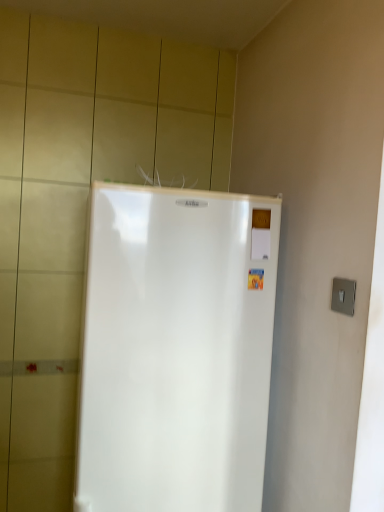
What do you see at coordinates (343, 296) in the screenshot? This screenshot has height=512, width=384. I see `satin silver switch at right` at bounding box center [343, 296].

Measure the distance between satin silver switch at right and camera.

satin silver switch at right is 1.01 meters from camera.

Find the location of a particular element. The height and width of the screenshot is (512, 384). satin silver switch at right is located at coordinates (343, 296).

Where is `white glossy refrigerator at center`? The image size is (384, 512). white glossy refrigerator at center is located at coordinates (175, 350).

What do you see at coordinates (175, 350) in the screenshot?
I see `white glossy refrigerator at center` at bounding box center [175, 350].

You are a GUI agent. You are given a task and a screenshot of the screen. Output one action in this format:
    pyautogui.click(x=<x>, y=<y>)
    Task: Click on the satin silver switch at right
    
    Given the screenshot: What is the action you would take?
    pyautogui.click(x=343, y=296)

Is satin silver switch at right at the right side of white glossy refrigerator at center?

Correct, you'll find satin silver switch at right to the right of white glossy refrigerator at center.

Is satin silver switch at right closer to the viewer compared to white glossy refrigerator at center?

Yes, it is in front of white glossy refrigerator at center.

Does point (342, 283) lie behind point (144, 378)?

No, (342, 283) is closer to viewer.

From the image's perspective, is satin silver switch at right located above or below white glossy refrigerator at center?

satin silver switch at right is above white glossy refrigerator at center.

From a real-world perspective, is satin silver switch at right above or below white glossy refrigerator at center?

In terms of real-world spatial position, satin silver switch at right is above white glossy refrigerator at center.

Can you confirm if satin silver switch at right is wider than white glossy refrigerator at center?

No.

Which of these two, satin silver switch at right or white glossy refrigerator at center, stands shorter?

satin silver switch at right is shorter.

In terms of size, does satin silver switch at right appear bigger or smaller than white glossy refrigerator at center?

In the image, satin silver switch at right appears to be smaller than white glossy refrigerator at center.

Is satin silver switch at right inside the boundaries of white glossy refrigerator at center, or outside?

satin silver switch at right is outside white glossy refrigerator at center.

Is satin silver switch at right directly adjacent to white glossy refrigerator at center?

Result: No.

Is satin silver switch at right facing towards white glossy refrigerator at center?

No, satin silver switch at right does not turn towards white glossy refrigerator at center.

How different are the orientations of satin silver switch at right and white glossy refrigerator at center in degrees?

80.8 degrees.

This screenshot has height=512, width=384. I want to click on electric outlet that appears in front of the white glossy refrigerator at center, so click(x=343, y=296).

Would you say white glossy refrigerator at center is to the left or to the right of satin silver switch at right in the picture?

Based on their positions, white glossy refrigerator at center is located to the left of satin silver switch at right.

Which object is further away from the camera, white glossy refrigerator at center or satin silver switch at right?

white glossy refrigerator at center is behind.

Is point (101, 312) positioned behind point (349, 309)?

Yes.

From the image's perspective, which one is positioned lower, white glossy refrigerator at center or satin silver switch at right?

white glossy refrigerator at center is shown below in the image.

From a real-world perspective, is white glossy refrigerator at center above or below satin silver switch at right?

From a real-world perspective, white glossy refrigerator at center is physically below satin silver switch at right.

Is white glossy refrigerator at center wider or thinner than satin silver switch at right?

Clearly, white glossy refrigerator at center has more width compared to satin silver switch at right.

Considering the relative sizes of white glossy refrigerator at center and satin silver switch at right in the image provided, is white glossy refrigerator at center taller than satin silver switch at right?

Yes, white glossy refrigerator at center is taller than satin silver switch at right.

Does white glossy refrigerator at center have a larger size compared to satin silver switch at right?

Yes, white glossy refrigerator at center is bigger than satin silver switch at right.

Can we say white glossy refrigerator at center lies outside satin silver switch at right?

That's correct, white glossy refrigerator at center is outside of satin silver switch at right.

Is white glossy refrigerator at center far away from satin silver switch at right?

That's not correct — white glossy refrigerator at center is a little close to satin silver switch at right.

Is white glossy refrigerator at center aimed at satin silver switch at right?

No, white glossy refrigerator at center is not turned towards satin silver switch at right.

Measure the distance between white glossy refrigerator at center and satin silver switch at right.

white glossy refrigerator at center is 19.06 inches away from satin silver switch at right.

Locate an element on the screen. Image resolution: width=384 pixels, height=512 pixels. electric outlet above the white glossy refrigerator at center (from the image's perspective) is located at coordinates (343, 296).

This screenshot has height=512, width=384. I want to click on refrigerator below the satin silver switch at right (from a real-world perspective), so click(x=175, y=350).

You are a GUI agent. You are given a task and a screenshot of the screen. Output one action in this format:
    pyautogui.click(x=<x>, y=<y>)
    Task: Click on the electric outlet located in front of the white glossy refrigerator at center
    
    Given the screenshot: What is the action you would take?
    343,296